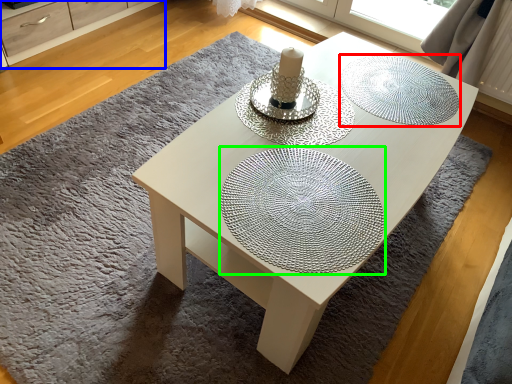
Question: Which object is positioned farthest from glass plate (highlighted by a red box)? Select from dresser (highlighted by a blue box) and glass plate (highlighted by a green box).

Choices:
 (A) dresser
 (B) glass plate

Answer: (A)